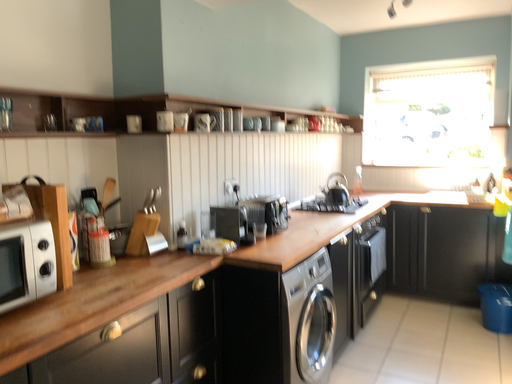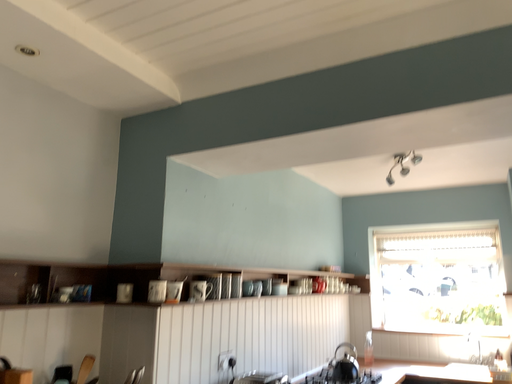
Question: How did the camera likely rotate when shooting the video?

Choices:
 (A) rotated upward
 (B) rotated downward

Answer: (A)